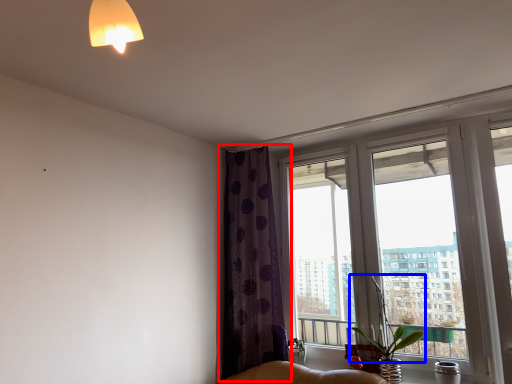
Question: Which object appears closest to the camera in this image, curtain (highlighted by a red box) or plant (highlighted by a blue box)?

Choices:
 (A) curtain
 (B) plant

Answer: (B)